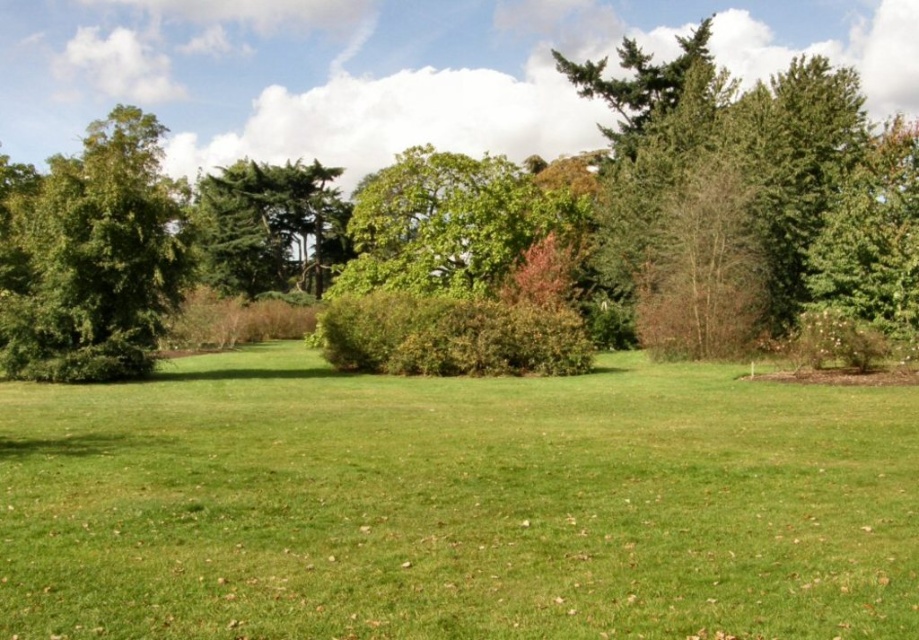
You are standing in the park and want to take a photo of the green leafy tree at left and the green textured tree at center. Which tree will appear larger in the photo?

The green leafy tree at left will appear larger in the photo because it is closer to you than the green textured tree at center.

You are planning to install a new bench in the park. The bench requires a minimum of 700 feet of space between two green leafy trees to ensure it is placed centrally between them. Based on the image, can the bench be placed between the green leafy tree at center and the green leafy tree at left?

The green leafy tree at center and the green leafy tree at left are 718.91 feet apart from each other, which exceeds the minimum requirement of 700 feet. Therefore, the bench can be placed between them as it meets the spacing requirement.